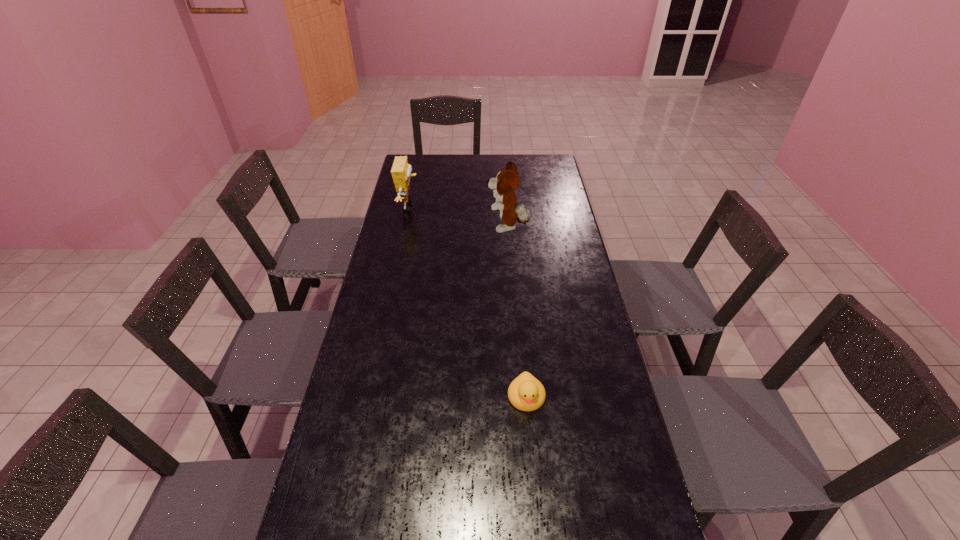
The image size is (960, 540). I want to click on object located at the left edge, so click(x=401, y=171).

In the image, there is a desktop. At what (x,y) coordinates should I click in order to perform the action: click on free space at the far edge. Please return your answer as a coordinate pair (x, y). The image size is (960, 540). Looking at the image, I should click on (481, 167).

The width and height of the screenshot is (960, 540). I want to click on free space at the left edge, so click(391, 234).

Identify the location of vacant region at the right edge of the desktop. The height and width of the screenshot is (540, 960). (574, 278).

Image resolution: width=960 pixels, height=540 pixels. What are the coordinates of `vacant space in between the second tallest object and the puppy` in the screenshot? It's located at (459, 218).

The width and height of the screenshot is (960, 540). I want to click on empty space that is in between the shortest object and the leftmost object, so click(468, 302).

The image size is (960, 540). Identify the location of empty space between the puppy and the duckling. (517, 313).

You are a GUI agent. You are given a task and a screenshot of the screen. Output one action in this format:
    pyautogui.click(x=<x>, y=<y>)
    Task: Click on the object that is the second nearest to the sponge
    
    Given the screenshot: What is the action you would take?
    pyautogui.click(x=526, y=393)

Find the location of a particular element. This screenshot has width=960, height=540. object that is the closest one to the puppy is located at coordinates (401, 171).